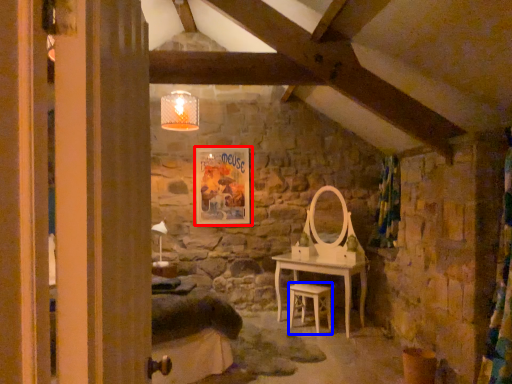
Question: Among these objects, which one is farthest to the camera, picture frame (highlighted by a red box) or chair (highlighted by a blue box)?

Choices:
 (A) picture frame
 (B) chair

Answer: (A)